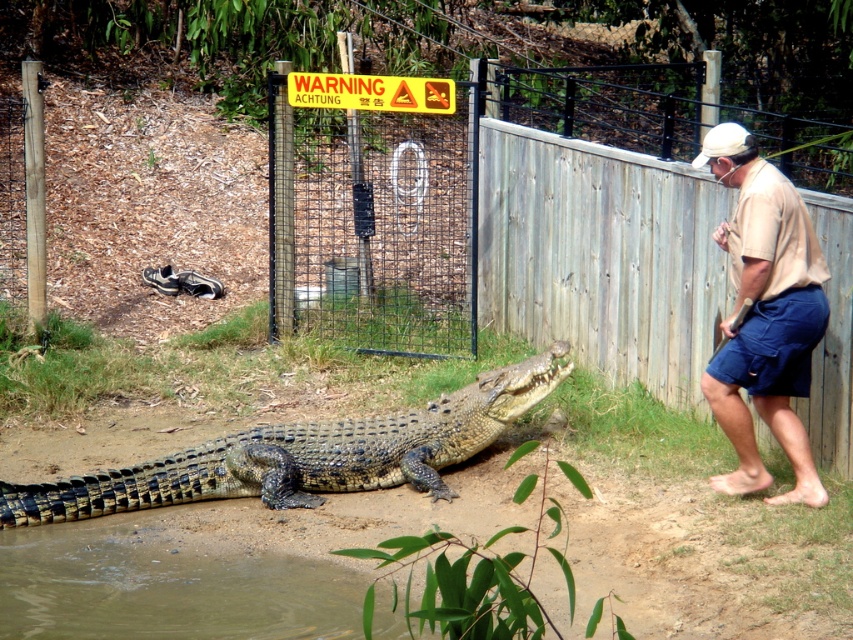
Consider the image. Is brown murky water at lower left thinner than shiny dark green scales at center?

Yes.

Is point (202, 560) closer to viewer compared to point (508, 397)?

That is True.

Where is `brown murky water at lower left`? brown murky water at lower left is located at coordinates (164, 588).

Which is more to the right, beige cotton shirt at right or blue cotton shorts at right?

Positioned to the right is blue cotton shorts at right.

Who is shorter, beige cotton shirt at right or blue cotton shorts at right?

Standing shorter between the two is blue cotton shorts at right.

Is point (728, 140) closer to viewer compared to point (782, 355)?

No, (728, 140) is behind (782, 355).

You are a GUI agent. You are given a task and a screenshot of the screen. Output one action in this format:
    pyautogui.click(x=<x>, y=<y>)
    Task: Click on the beige cotton shirt at right
    The width and height of the screenshot is (853, 640).
    Given the screenshot: What is the action you would take?
    pyautogui.click(x=764, y=316)

Does shiny dark green scales at center appear over blue cotton shorts at right?

No.

Can you confirm if shiny dark green scales at center is positioned below blue cotton shorts at right?

Yes.

Is point (392, 458) closer to viewer compared to point (729, 378)?

No, it is behind (729, 378).

Where is `shiny dark green scales at center`? The height and width of the screenshot is (640, 853). shiny dark green scales at center is located at coordinates (306, 454).